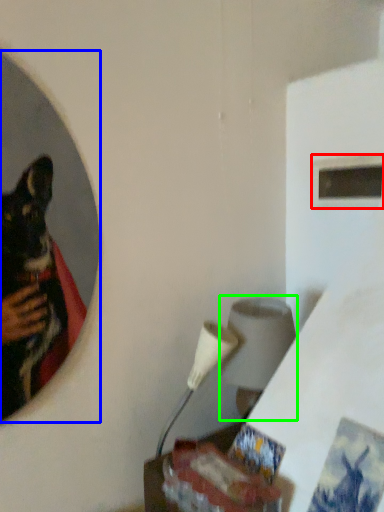
Question: Which object is positioned farthest from window (highlighted by a red box)? Select from mirror (highlighted by a blue box) and lamp (highlighted by a green box).

Choices:
 (A) mirror
 (B) lamp

Answer: (A)